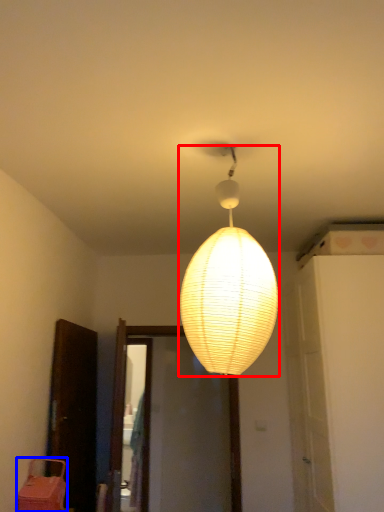
Question: Which object is further to the camera taking this photo, lamp (highlighted by a red box) or furniture (highlighted by a blue box)?

Choices:
 (A) lamp
 (B) furniture

Answer: (B)